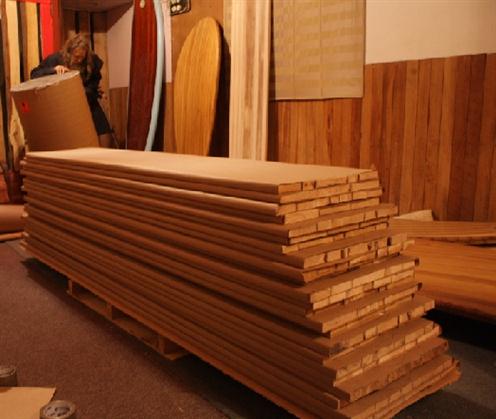
Locate an element on the screen. This screenshot has height=419, width=496. boards leaning up against the wall is located at coordinates (202, 68), (148, 48).